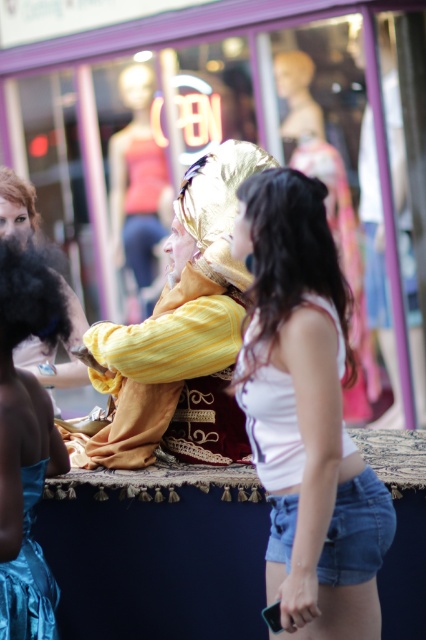
You are a photographer trying to capture a clear shot of both the shiny teal fabric dress at lower left and the blonde synthetic wig at upper left. Since the scene is crowded, you need to adjust your position to ensure both are visible without one blocking the other. Which object should you focus on first to avoid obstruction?

You should focus on the shiny teal fabric dress at lower left first because it is in front of the blonde synthetic wig at upper left, so adjusting your position to capture it without blocking the wig behind might require prioritizing the foreground object.

You are a photographer trying to capture a clear photo of both the shiny gold wig at center and the white matte tank top at center. Since you want both items to be in focus, which one should you adjust your camera lens to prioritize focusing on first?

You should focus on the shiny gold wig at center first because it is closer to the viewer than the white matte tank top at center, so adjusting focus starting from the closer object ensures both will be in focus.

You are a photographer trying to capture a clear shot of the shiny gold wig at center and the white matte tank top at center. Which object should you focus on first if you want to ensure both are in focus?

The shiny gold wig at center is positioned over the white matte tank top at center, so focusing on the shiny gold wig at center first would ensure both are in focus since it is closer to the camera.